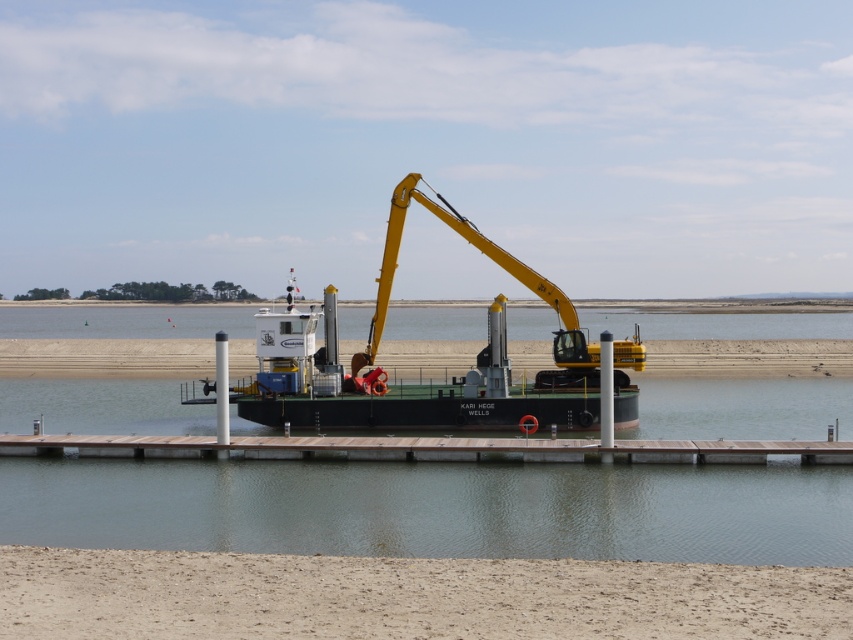
Question: Is green matte barge at center in front of brown wooden dock at center?

Choices:
 (A) no
 (B) yes

Answer: (A)

Question: Which object is farther from the camera taking this photo?

Choices:
 (A) green matte barge at center
 (B) brown wooden dock at center

Answer: (A)

Question: Which point is closer to the camera?

Choices:
 (A) 234,458
 (B) 576,320

Answer: (A)

Question: From the image, what is the correct spatial relationship of green matte barge at center in relation to brown wooden dock at center?

Choices:
 (A) below
 (B) above

Answer: (B)

Question: Is the position of green matte barge at center more distant than that of brown wooden dock at center?

Choices:
 (A) no
 (B) yes

Answer: (B)

Question: Which of the following is the farthest from the observer?

Choices:
 (A) brown wooden dock at center
 (B) green matte barge at center

Answer: (B)